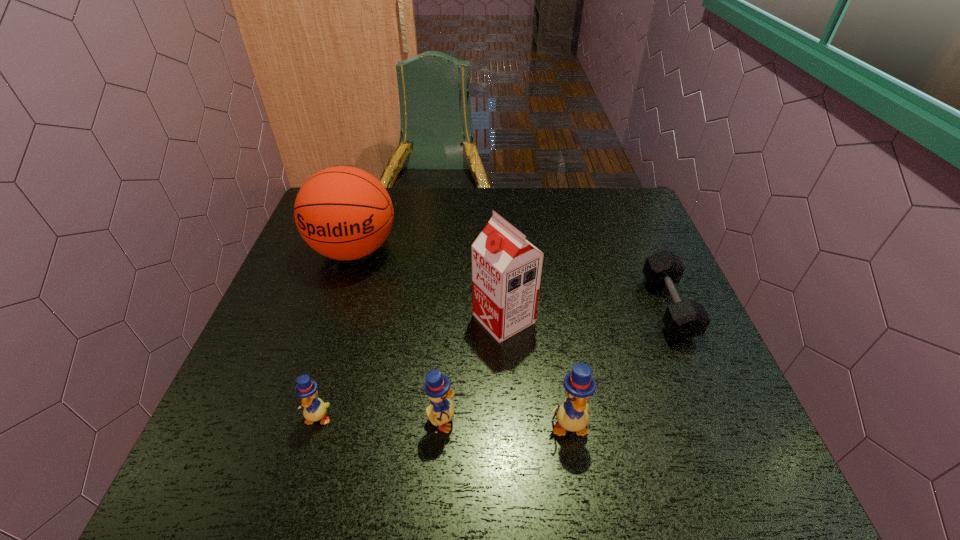
At what (x,y) coordinates should I click in order to perform the action: click on free region located 0.280m on the side with logo of the basketball. Please return your answer as a coordinate pair (x, y). Looking at the image, I should click on (315, 368).

The image size is (960, 540). Find the location of `vacant space located on the left of the rightmost object`. vacant space located on the left of the rightmost object is located at coordinates (502, 307).

This screenshot has width=960, height=540. I want to click on free space located on the right of the fourth object from left to right, so click(560, 319).

Locate an element on the screen. object that is at the far edge is located at coordinates (344, 213).

What are the coordinates of `object present at the left edge` in the screenshot? It's located at (344, 213).

The width and height of the screenshot is (960, 540). Find the location of `object that is at the right edge`. object that is at the right edge is located at coordinates (685, 319).

This screenshot has height=540, width=960. I want to click on object that is at the far left corner, so click(344, 213).

The height and width of the screenshot is (540, 960). Find the location of `vacant region at the far edge of the desktop`. vacant region at the far edge of the desktop is located at coordinates (573, 193).

In order to click on vacant region at the left edge in this screenshot , I will do `click(238, 388)`.

In the image, there is a desktop. Find the location of `free space at the right edge`. free space at the right edge is located at coordinates (653, 346).